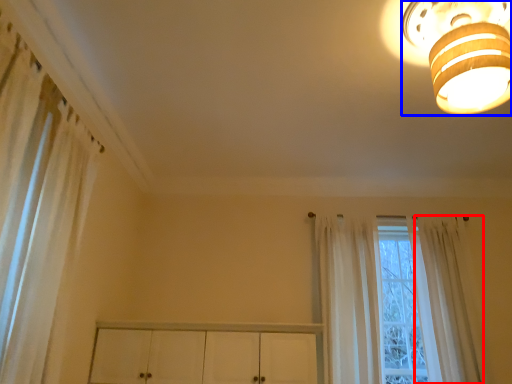
Question: Which point is closer to the camera, curtain (highlighted by a red box) or lamp (highlighted by a blue box)?

Choices:
 (A) curtain
 (B) lamp

Answer: (B)